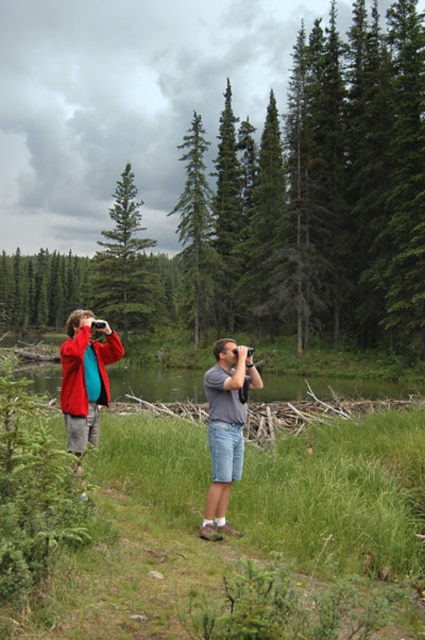
Is denim shorts at center shorter than matte red jacket at left?

Correct, denim shorts at center is not as tall as matte red jacket at left.

Can you confirm if denim shorts at center is taller than matte red jacket at left?

In fact, denim shorts at center may be shorter than matte red jacket at left.

Is point (224, 524) farther from viewer compared to point (67, 433)?

Yes, it is.

This screenshot has height=640, width=425. What are the coordinates of `denim shorts at center` in the screenshot? It's located at (226, 429).

Is point (150, 380) positioned in front of point (102, 380)?

No, (150, 380) is further to viewer.

Which is below, green grassy lake at center or matte red jacket at left?

green grassy lake at center

Between point (144, 378) and point (87, 360), which one is positioned in front?

Point (87, 360) is in front.

Identify the location of green grassy lake at center. (331, 387).

Looking at this image, is green grassy lake at center closer to camera compared to green matte tree at center?

Yes, it is.

Who is more forward, (300, 396) or (192, 317)?

Point (300, 396) is more forward.

Is point (56, 380) positioned behind point (209, 234)?

No, it is not.

Find the location of a particular element. green grassy lake at center is located at coordinates (331, 387).